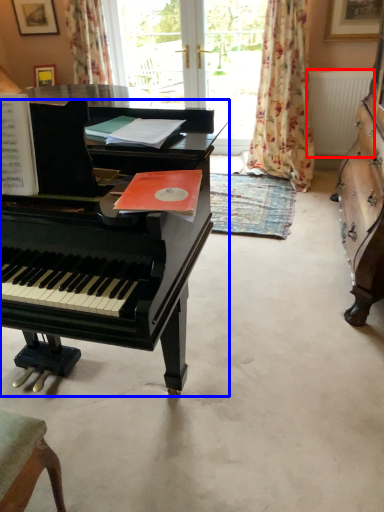
Question: Which point is further to the camera, radiator (highlighted by a red box) or piano (highlighted by a blue box)?

Choices:
 (A) radiator
 (B) piano

Answer: (A)